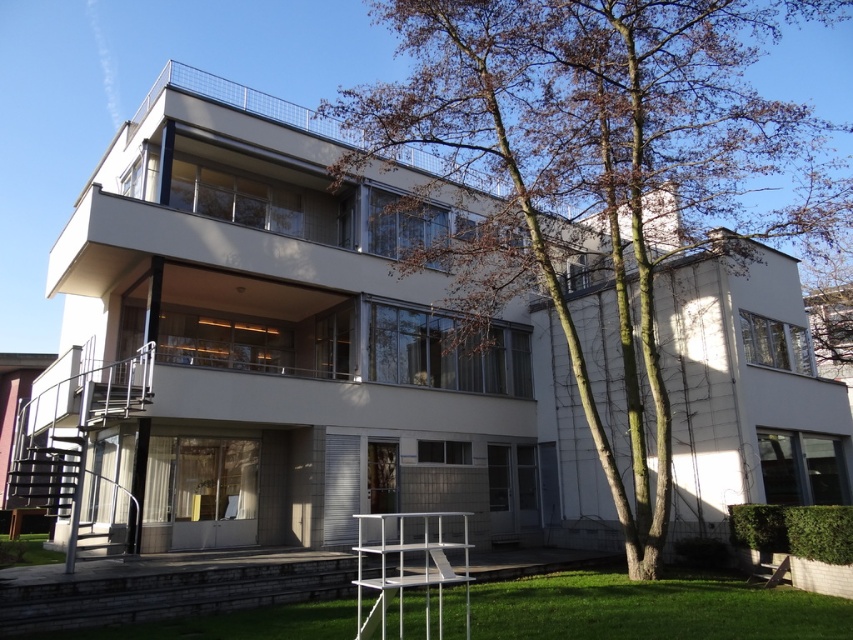
Is white metal chair at lower center smaller than green grass at lower left?

Correct, white metal chair at lower center occupies less space than green grass at lower left.

Is white metal chair at lower center bigger than green grass at lower left?

Incorrect, white metal chair at lower center is not larger than green grass at lower left.

Does point (447, 513) come behind point (57, 561)?

Yes.

Locate an element on the screen. The image size is (853, 640). white metal chair at lower center is located at coordinates (408, 566).

Can you confirm if brown leafy tree at center is shorter than white metal chair at lower center?

No.

Where is `brown leafy tree at center`? The image size is (853, 640). brown leafy tree at center is located at coordinates (592, 170).

What do you see at coordinates (651, 609) in the screenshot?
I see `green grass at lower center` at bounding box center [651, 609].

Can you confirm if green grass at lower center is smaller than white metal chair at lower center?

Incorrect, green grass at lower center is not smaller in size than white metal chair at lower center.

Is point (764, 604) farther from camera compared to point (463, 557)?

That is False.

Identify the location of green grass at lower center. This screenshot has width=853, height=640. (651, 609).